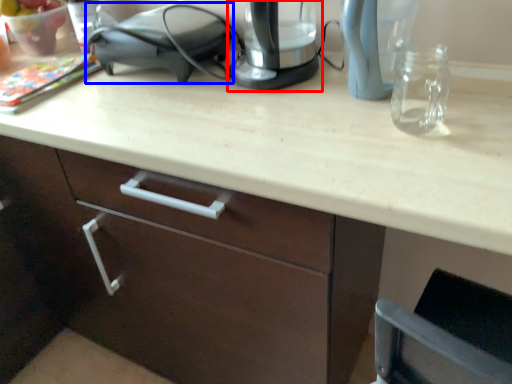
Question: Which of the following is the closest to the observer, home appliance (highlighted by a red box) or appliance (highlighted by a blue box)?

Choices:
 (A) home appliance
 (B) appliance

Answer: (A)